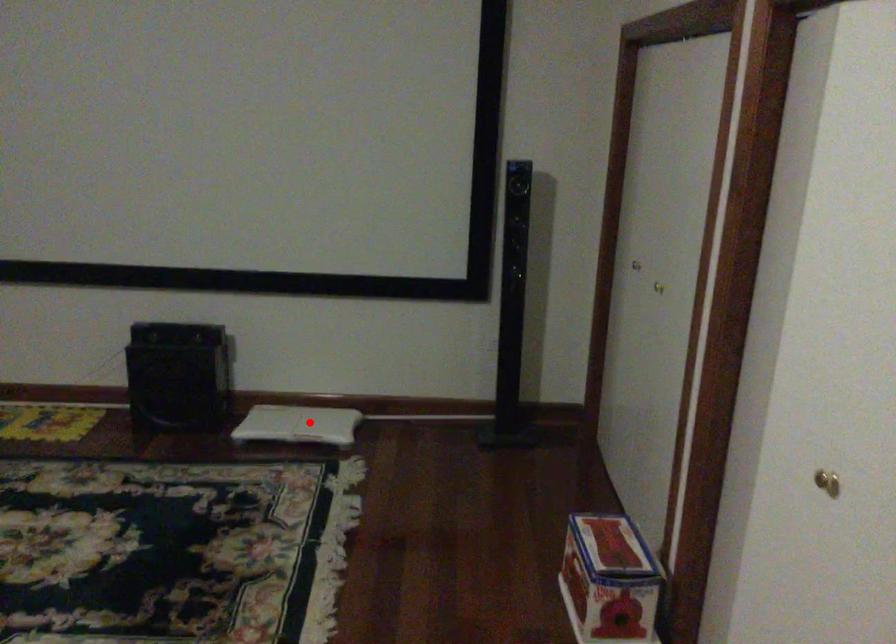
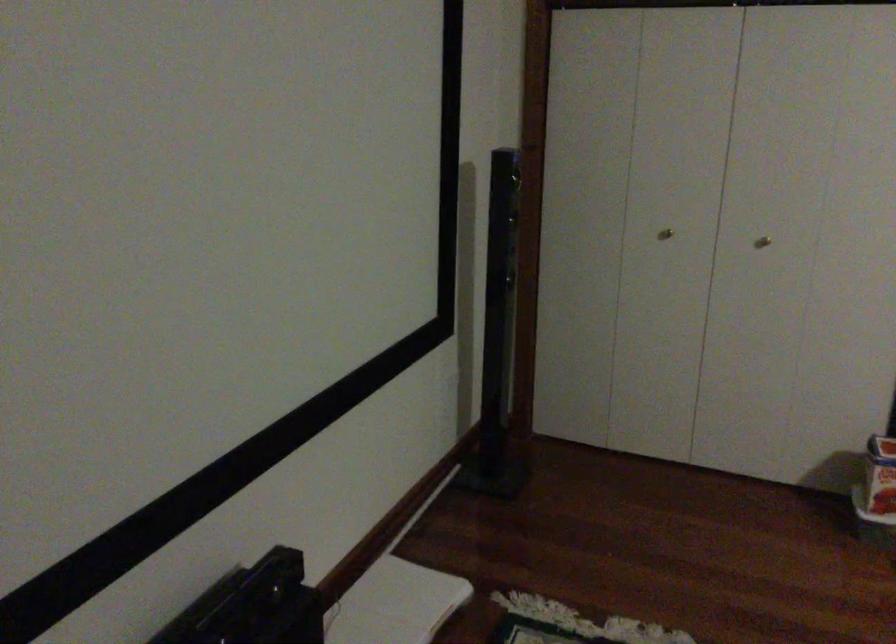
Locate, in the second image, the point that corresponds to the highlighted location in the first image.

(394, 603)